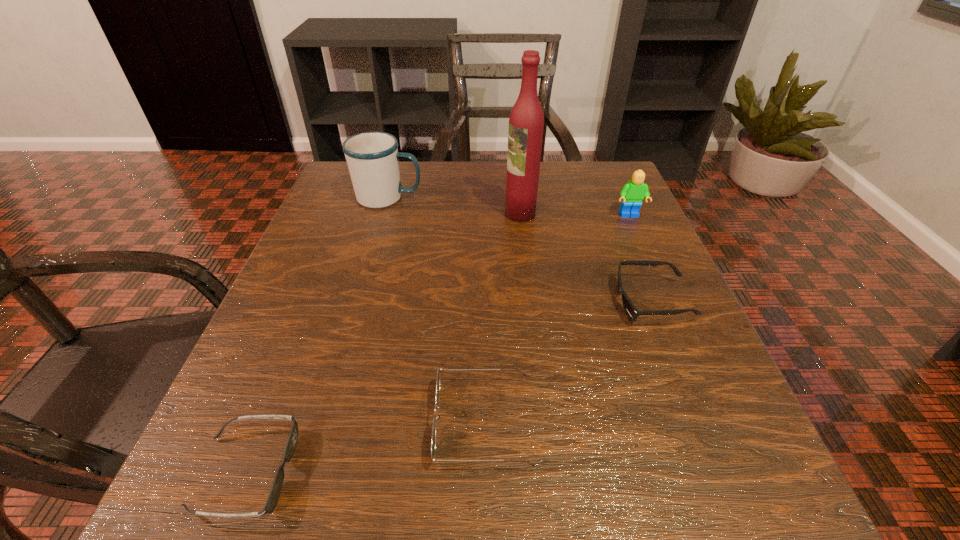
Where is `vacant space located 0.300m on the label of the tallest object`? The image size is (960, 540). vacant space located 0.300m on the label of the tallest object is located at coordinates (368, 214).

Identify the location of vacant region located on the handle side of the mug. (510, 198).

Identify the location of free space located on the face of the Lego. The height and width of the screenshot is (540, 960). (690, 353).

Where is `vacant space located on the front-facing side of the second sunglasses from left to right`? Image resolution: width=960 pixels, height=540 pixels. vacant space located on the front-facing side of the second sunglasses from left to right is located at coordinates (288, 423).

Where is `free location located on the front-facing side of the second sunglasses from left to right`? free location located on the front-facing side of the second sunglasses from left to right is located at coordinates (243, 423).

Where is `vacant space located on the front-facing side of the second sunglasses from left to right`? Image resolution: width=960 pixels, height=540 pixels. vacant space located on the front-facing side of the second sunglasses from left to right is located at coordinates (296, 423).

At what (x,y) coordinates should I click in order to perform the action: click on vacant space located 0.330m on the front-facing side of the farthest sunglasses. Please return your answer as a coordinate pair (x, y). This screenshot has width=960, height=540. Looking at the image, I should click on coord(425,302).

Locate an element on the screen. vacant space located 0.120m on the front-facing side of the farthest sunglasses is located at coordinates (547, 302).

Find the location of a particular element. This screenshot has height=540, width=960. vacant space situated on the front-facing side of the farthest sunglasses is located at coordinates (588, 302).

Where is `vacant space located on the front-facing side of the shortest object`? vacant space located on the front-facing side of the shortest object is located at coordinates (583, 472).